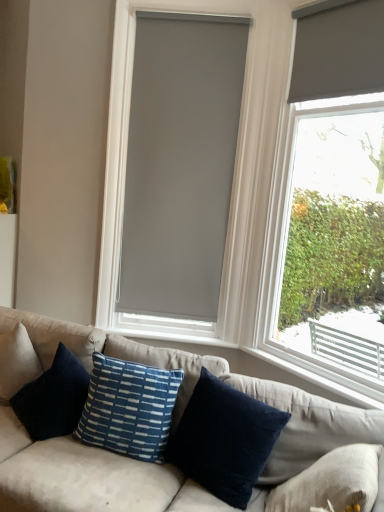
What do you see at coordinates (297, 377) in the screenshot? The image size is (384, 512). I see `white plastic window sill at lower right` at bounding box center [297, 377].

Measure the distance between point (97, 365) and camera.

Point (97, 365) is 2.15 meters from camera.

What do you see at coordinates (198, 377) in the screenshot? Image resolution: width=384 pixels, height=512 pixels. I see `velvet blue pillows at center` at bounding box center [198, 377].

The image size is (384, 512). What do you see at coordinates (224, 439) in the screenshot? I see `navy blue cotton pillow at center, the second pillow from the left` at bounding box center [224, 439].

In order to face matte gray roller blind at right, should I rotate leftwards or rightwards?

To face it directly, rotate right by 18.366 degrees.

What is the approximate height of matte gray roller blind at right?

The height of matte gray roller blind at right is 7.65 feet.

Find the location of a particular element. The width and height of the screenshot is (384, 512). white plastic window sill at lower right is located at coordinates (297, 377).

Is blue textured pillow at center, the second pillow when ordered from right to left, beside white plastic window sill at lower right?

There is a gap between blue textured pillow at center, the second pillow when ordered from right to left, and white plastic window sill at lower right.

The height and width of the screenshot is (512, 384). In order to click on pillow positioned vertically above the white plastic window sill at lower right (from a real-world perspective) in this screenshot , I will do `click(129, 408)`.

Can you confirm if blue textured pillow at center, the second pillow when ordered from right to left, is thinner than white plastic window sill at lower right?

No.

From the image's perspective, between matte gray roller blind at upper right, the first window blind in the front-to-back sequence, and navy blue cotton pillow at center, the second pillow from the left, which one is located above?

From the image's view, matte gray roller blind at upper right, the first window blind in the front-to-back sequence, is above.

Does matte gray roller blind at upper right, arranged as the second window blind when viewed from the left, turn towards navy blue cotton pillow at center, the second pillow from the left?

No, matte gray roller blind at upper right, arranged as the second window blind when viewed from the left, does not turn towards navy blue cotton pillow at center, the second pillow from the left.

From the picture: Considering the sizes of objects matte gray roller blind at upper right, which is the 2th window blind in back-to-front order, and navy blue cotton pillow at center, marked as the first pillow in a right-to-left arrangement, in the image provided, who is taller, matte gray roller blind at upper right, which is the 2th window blind in back-to-front order, or navy blue cotton pillow at center, marked as the first pillow in a right-to-left arrangement,?

navy blue cotton pillow at center, marked as the first pillow in a right-to-left arrangement, is taller.

Is gray matte blind at center, placed as the first window blind when sorted from left to right, completely or partially inside blue textured pillow at center, the second pillow when ordered from right to left?

No, gray matte blind at center, placed as the first window blind when sorted from left to right, is not surrounded by blue textured pillow at center, the second pillow when ordered from right to left.

Which is closer to the camera, (145, 456) or (219, 198)?

Point (145, 456).

Considering the sizes of objects blue textured pillow at center, the second pillow when ordered from right to left, and gray matte blind at center, the second window blind in the right-to-left sequence, in the image provided, who is thinner, blue textured pillow at center, the second pillow when ordered from right to left, or gray matte blind at center, the second window blind in the right-to-left sequence,?

gray matte blind at center, the second window blind in the right-to-left sequence.

Could you tell me if blue textured pillow at center, which is counted as the first pillow, starting from the left, is turned towards gray matte blind at center, marked as the second window blind in a front-to-back arrangement?

No, blue textured pillow at center, which is counted as the first pillow, starting from the left, is not oriented towards gray matte blind at center, marked as the second window blind in a front-to-back arrangement.

This screenshot has width=384, height=512. What are the coordinates of `window sill that is on the left side of matte gray roller blind at upper right, arranged as the second window blind when viewed from the left` in the screenshot? It's located at (297, 377).

Which is in front, matte gray roller blind at upper right, arranged as the second window blind when viewed from the left, or white plastic window sill at lower right?

matte gray roller blind at upper right, arranged as the second window blind when viewed from the left.

Visually, is matte gray roller blind at upper right, the first window blind in the front-to-back sequence, positioned to the left or to the right of white plastic window sill at lower right?

From the image, it's evident that matte gray roller blind at upper right, the first window blind in the front-to-back sequence, is to the right of white plastic window sill at lower right.

From the image's perspective, relative to white plastic window sill at lower right, is matte gray roller blind at upper right, the first window blind in the front-to-back sequence, above or below?

Based on their image positions, matte gray roller blind at upper right, the first window blind in the front-to-back sequence, is located above white plastic window sill at lower right.

Could you tell me if velvet blue pillows at center is turned towards navy blue cotton pillow at center, marked as the first pillow in a right-to-left arrangement?

Yes, velvet blue pillows at center is oriented towards navy blue cotton pillow at center, marked as the first pillow in a right-to-left arrangement.

Based on the photo, is velvet blue pillows at center next to navy blue cotton pillow at center, the second pillow from the left?

There is a gap between velvet blue pillows at center and navy blue cotton pillow at center, the second pillow from the left.

Is the position of velvet blue pillows at center less distant than that of navy blue cotton pillow at center, marked as the first pillow in a right-to-left arrangement?

Yes.

From a real-world perspective, which object stands above the other?

blue textured pillow at center, which is counted as the first pillow, starting from the left, is physically above.

Is blue textured pillow at center, the second pillow when ordered from right to left, not inside navy blue cotton pillow at center, the second pillow from the left?

Yes, blue textured pillow at center, the second pillow when ordered from right to left, is not within navy blue cotton pillow at center, the second pillow from the left.

Between blue textured pillow at center, which is counted as the first pillow, starting from the left, and navy blue cotton pillow at center, the second pillow from the left, which one has smaller size?

With smaller size is blue textured pillow at center, which is counted as the first pillow, starting from the left.

Is blue textured pillow at center, the second pillow when ordered from right to left, to the right of navy blue cotton pillow at center, marked as the first pillow in a right-to-left arrangement, from the viewer's perspective?

Incorrect, blue textured pillow at center, the second pillow when ordered from right to left, is not on the right side of navy blue cotton pillow at center, marked as the first pillow in a right-to-left arrangement.

Is blue textured pillow at center, which is counted as the first pillow, starting from the left, positioned far away from matte gray roller blind at right?

blue textured pillow at center, which is counted as the first pillow, starting from the left, is far away from matte gray roller blind at right.

Is blue textured pillow at center, which is counted as the first pillow, starting from the left, oriented away from matte gray roller blind at right?

blue textured pillow at center, which is counted as the first pillow, starting from the left, does not have its back to matte gray roller blind at right.

From the image's perspective, between blue textured pillow at center, the second pillow when ordered from right to left, and matte gray roller blind at right, which one is located above?

From the image's view, matte gray roller blind at right is above.

This screenshot has height=512, width=384. I want to click on window sill lying behind the blue textured pillow at center, which is counted as the first pillow, starting from the left, so click(x=297, y=377).

From the image's perspective, starting from the navy blue cotton pillow at center, marked as the first pillow in a right-to-left arrangement, which window blind is the 2nd one above? Please provide its 2D coordinates.

[(338, 50)]

From the image, which object appears to be farther from matte gray roller blind at right, gray matte blind at center, the 1th window blind when ordered from back to front, or blue textured pillow at center, which is counted as the first pillow, starting from the left?

blue textured pillow at center, which is counted as the first pillow, starting from the left, is further to matte gray roller blind at right.

Looking at this image, from the image, which object appears to be nearer to navy blue cotton pillow at center, marked as the first pillow in a right-to-left arrangement, matte gray roller blind at upper right, the first window blind in the front-to-back sequence, or matte gray roller blind at right?

matte gray roller blind at right lies closer to navy blue cotton pillow at center, marked as the first pillow in a right-to-left arrangement, than the other object.

Based on their spatial positions, is velvet blue pillows at center or matte gray roller blind at upper right, the first window blind in the front-to-back sequence, further from matte gray roller blind at right?

velvet blue pillows at center is positioned further to the anchor matte gray roller blind at right.

Considering their positions, is white plastic window sill at lower right positioned closer to gray matte blind at center, the 1th window blind when ordered from back to front, than blue textured pillow at center, which is counted as the first pillow, starting from the left?

The object closer to gray matte blind at center, the 1th window blind when ordered from back to front, is white plastic window sill at lower right.

From the image, which object appears to be nearer to velvet blue pillows at center, matte gray roller blind at upper right, which is the 2th window blind in back-to-front order, or matte gray roller blind at right?

The object closer to velvet blue pillows at center is matte gray roller blind at right.

Considering their positions, is gray matte blind at center, the second window blind in the right-to-left sequence, positioned further to blue textured pillow at center, which is counted as the first pillow, starting from the left, than navy blue cotton pillow at center, the second pillow from the left?

Among the two, gray matte blind at center, the second window blind in the right-to-left sequence, is located further to blue textured pillow at center, which is counted as the first pillow, starting from the left.

Looking at the image, which one is located further to matte gray roller blind at upper right, arranged as the second window blind when viewed from the left, velvet blue pillows at center or gray matte blind at center, placed as the first window blind when sorted from left to right?

velvet blue pillows at center.

When comparing their distances from white plastic window sill at lower right, does blue textured pillow at center, which is counted as the first pillow, starting from the left, or matte gray roller blind at right seem closer?

matte gray roller blind at right is closer to white plastic window sill at lower right.

In order to click on pillow between matte gray roller blind at upper right, the first window blind in the front-to-back sequence, and white plastic window sill at lower right in the up-down direction in this screenshot , I will do `click(129, 408)`.

The height and width of the screenshot is (512, 384). I want to click on window that lies between matte gray roller blind at upper right, the 1th window blind viewed from the right, and blue textured pillow at center, the second pillow when ordered from right to left, from top to bottom, so click(x=284, y=254).

The image size is (384, 512). Identify the location of window sill between matte gray roller blind at right and velvet blue pillows at center in the up-down direction. (297, 377).

Where is `window blind between matte gray roller blind at upper right, the first window blind in the front-to-back sequence, and blue textured pillow at center, the second pillow when ordered from right to left, in the vertical direction`? The width and height of the screenshot is (384, 512). window blind between matte gray roller blind at upper right, the first window blind in the front-to-back sequence, and blue textured pillow at center, the second pillow when ordered from right to left, in the vertical direction is located at coordinates (180, 163).